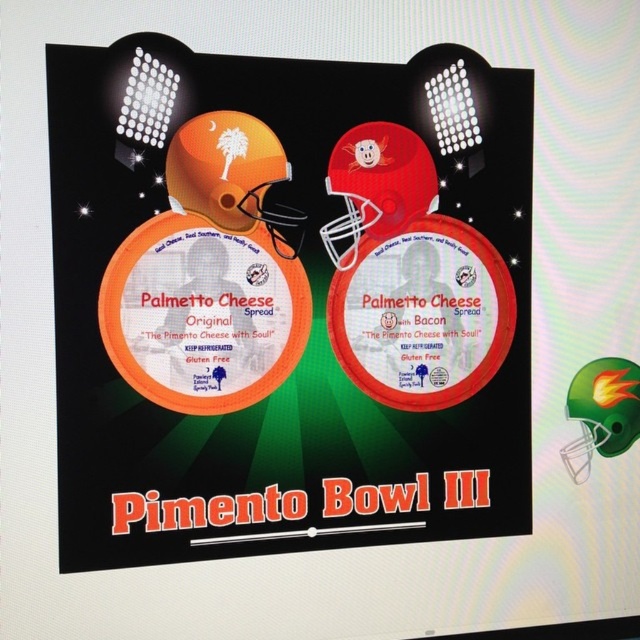
You are a customer trying to read the labels on both the matte red helmet at center and the orange matte helmet at upper left. Which helmet is closer to you, making its label easier to read?

The matte red helmet at center is closer to you than the orange matte helmet at upper left, so its label is easier to read.

Looking at this image, you are a customer looking at the Palmetto Cheese Spread containers displayed in the promotional graphic. Which orange matte helmet is bigger between the orange matte helmet at upper center and the orange matte helmet at upper left?

The orange matte helmet at upper center is larger in size compared to the orange matte helmet at upper left.